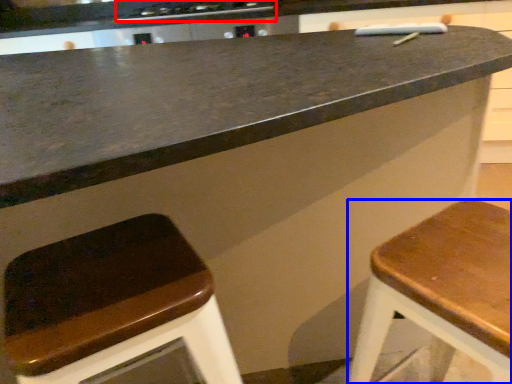
Question: Which object appears closest to the camera in this image, stove (highlighted by a red box) or stool (highlighted by a blue box)?

Choices:
 (A) stove
 (B) stool

Answer: (B)